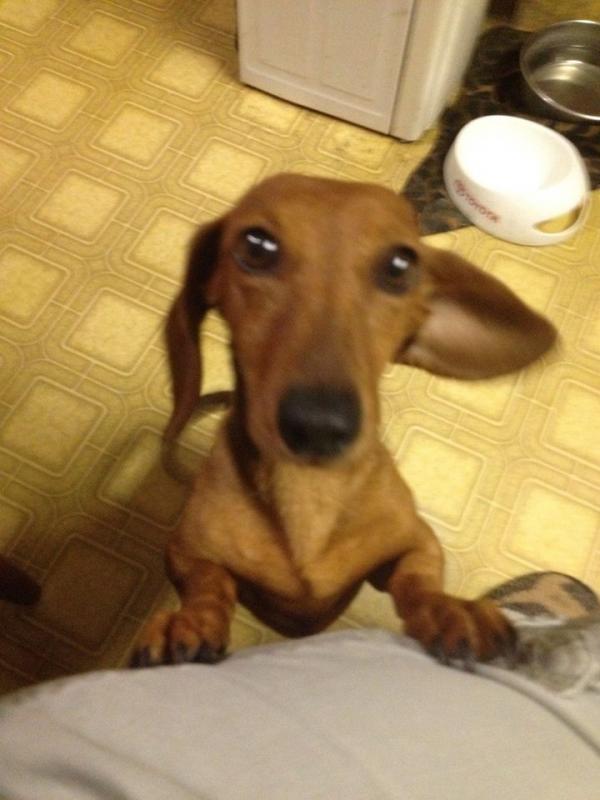
This screenshot has height=800, width=600. I want to click on nasty yellowish floor, so click(573, 278).